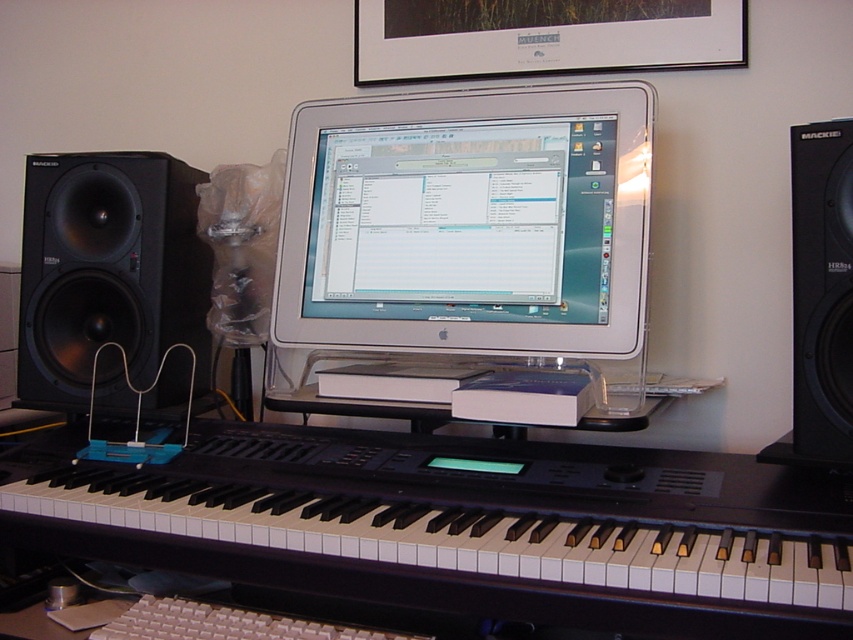
At what (x,y) coordinates should I click in order to perform the action: click on black plastic keyboard at lower center. Please return your answer as a coordinate pair (x, y). The image size is (853, 640). Looking at the image, I should click on (462, 525).

Which of these two, black plastic keyboard at lower center or white glossy desktop computer at center, stands shorter?

Standing shorter between the two is black plastic keyboard at lower center.

Between point (738, 538) and point (393, 180), which one is positioned behind?

The point (393, 180) is more distant.

Identify the location of black plastic keyboard at lower center. (462, 525).

Can you confirm if black matte speaker at left is thinner than black matte speaker at right?

No, black matte speaker at left is not thinner than black matte speaker at right.

Identify the location of black matte speaker at left. (108, 269).

Does black plastic keyboard at lower center come behind white plastic keyboard at center?

No.

Which is in front, point (821, 486) or point (236, 628)?

Point (236, 628) is more forward.

Identify the location of black plastic keyboard at lower center. This screenshot has width=853, height=640. (462, 525).